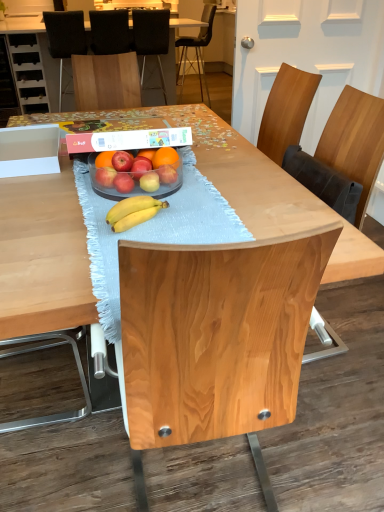
Where is `free space in front of red matte apple at center, the third apple in the right-to-left sequence`? The height and width of the screenshot is (512, 384). free space in front of red matte apple at center, the third apple in the right-to-left sequence is located at coordinates (153, 208).